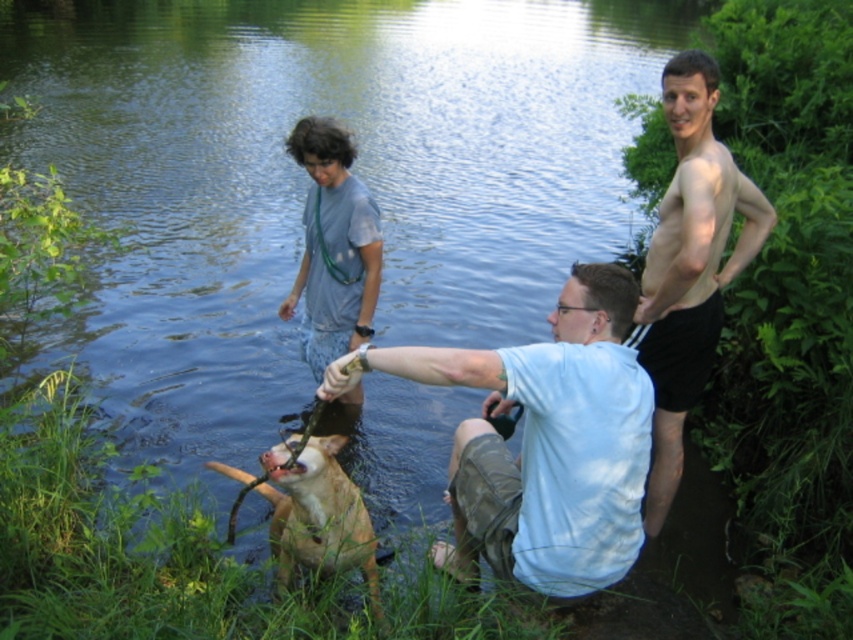
You are a photographer trying to capture a clear shot of both the skinny tan skin at right and the gray cotton shirt at center. Based on their positions, which object is closer to the camera?

The skinny tan skin at right is closer to the camera than the gray cotton shirt at center because it might be wider than the gray cotton shirt at center.

You are a photographer trying to capture a photo of the gray cotton shirt at center and the tan leather dog at lower center. Which object should you zoom in on more to ensure both are in focus?

The gray cotton shirt at center is thinner than the tan leather dog at lower center, so you should zoom in more on the gray cotton shirt at center to ensure both are in focus.

You are standing at the point marked by coordinates point (548, 444). What object is located exactly at that point?

The light blue shirt at center is located at point (548, 444).